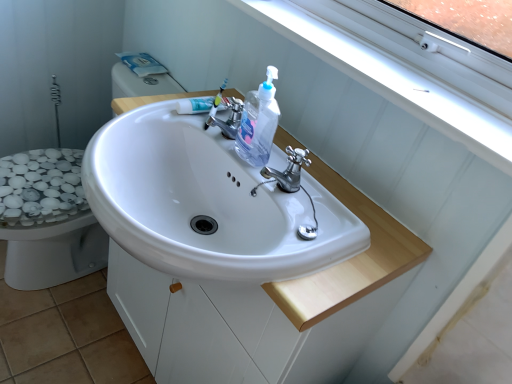
Find the location of a particular element. This screenshot has width=512, height=384. vacant area that is in front of polished chrome faucet at center, the second tap positioned from the back is located at coordinates (301, 261).